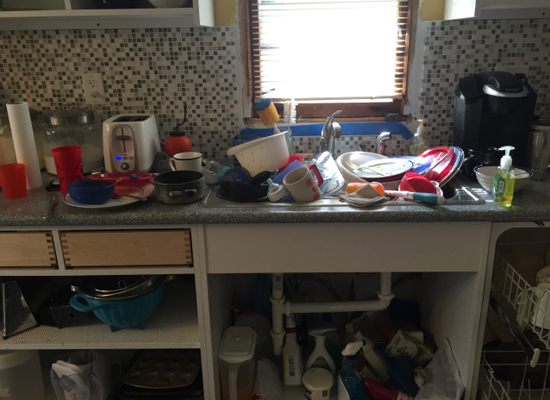
This screenshot has width=550, height=400. In order to click on cleaning spray in this screenshot , I will do `click(291, 360)`, `click(320, 351)`, `click(346, 360)`, `click(368, 353)`, `click(382, 393)`.